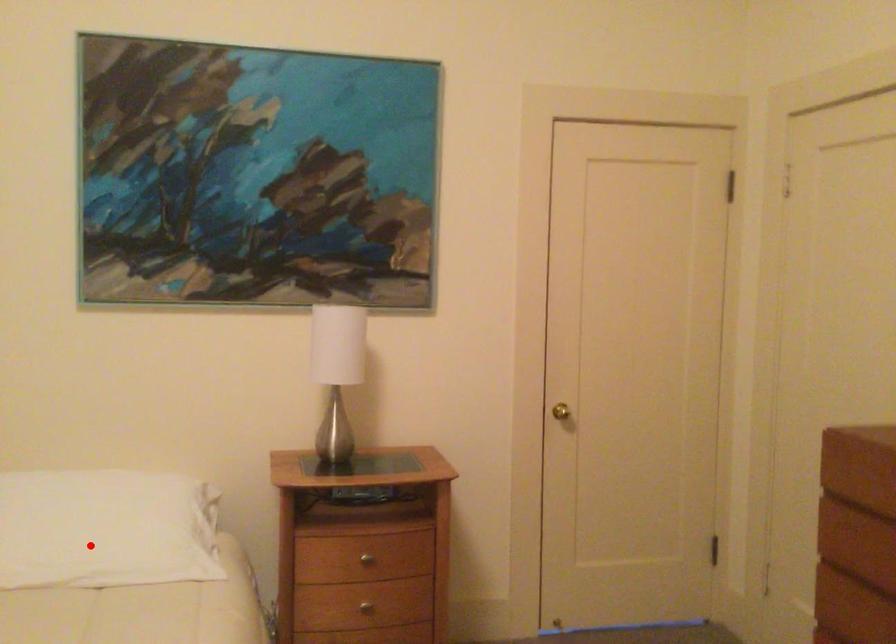
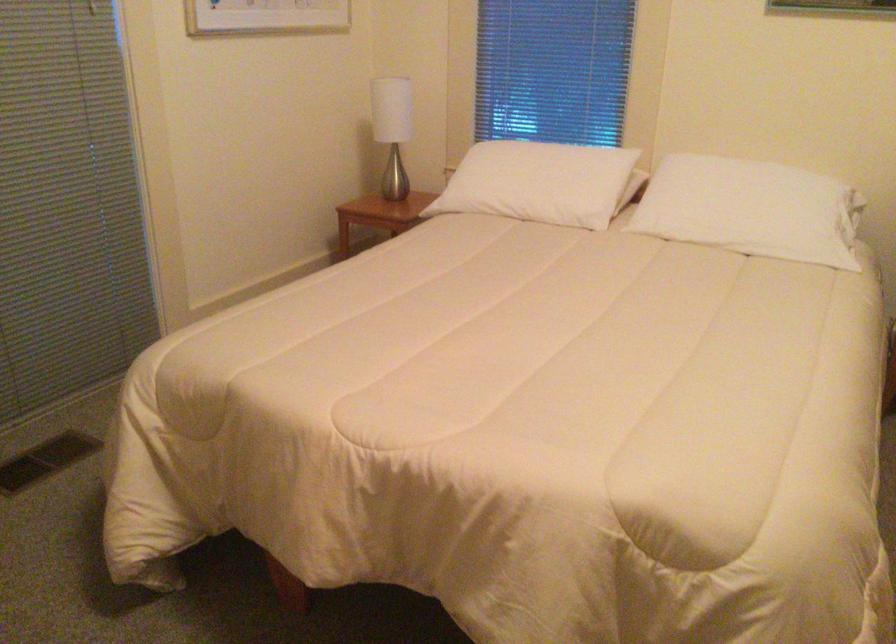
The point at the highlighted location is marked in the first image. Where is the corresponding point in the second image?

(752, 210)